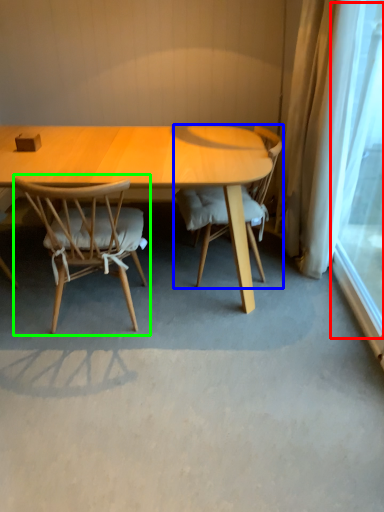
Question: Estimate the real-world distances between objects in this image. Which object is closer to window screen (highlighted by a red box), chair (highlighted by a blue box) or chair (highlighted by a green box)?

Choices:
 (A) chair
 (B) chair

Answer: (A)